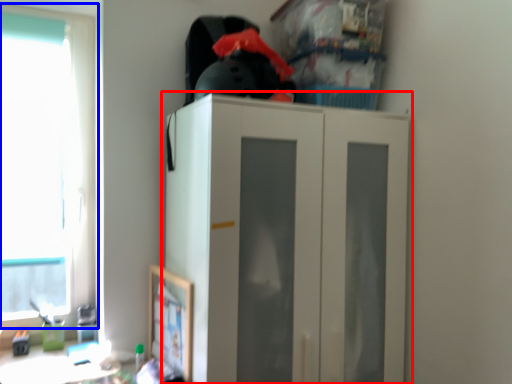
Question: Which object is further to the camera taking this photo, cupboard (highlighted by a red box) or window (highlighted by a blue box)?

Choices:
 (A) cupboard
 (B) window

Answer: (B)